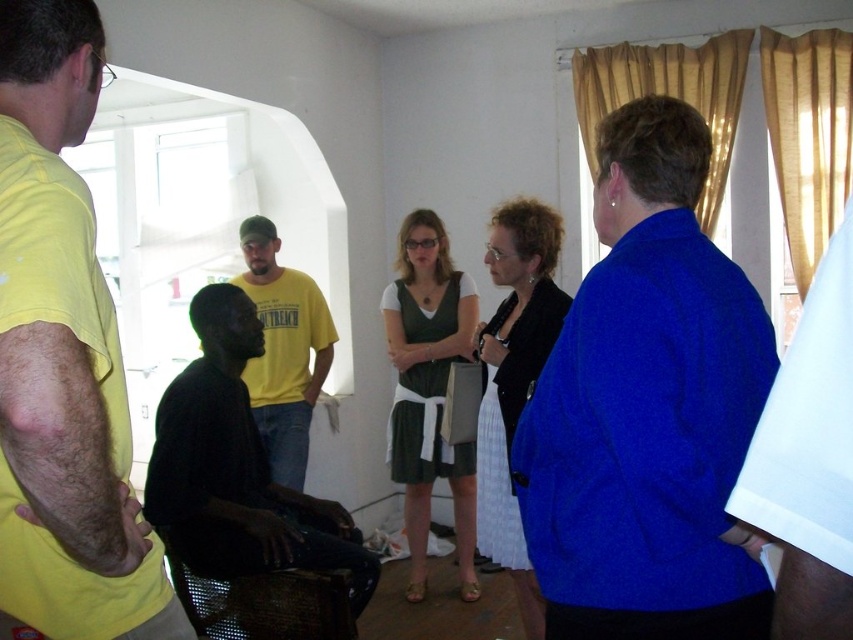
Question: Does yellow matte shirt at left have a greater width compared to yellow cotton t-shirt at center?

Choices:
 (A) no
 (B) yes

Answer: (A)

Question: Is black satin blouse at center above yellow cotton t-shirt at center?

Choices:
 (A) yes
 (B) no

Answer: (B)

Question: Estimate the real-world distances between objects in this image. Which object is farther from the matte green dress at center?

Choices:
 (A) black matte shirt at lower left
 (B) black satin blouse at center
 (C) yellow matte shirt at left
 (D) yellow cotton t-shirt at center

Answer: (C)

Question: Can you confirm if yellow matte shirt at left is positioned to the right of black satin blouse at center?

Choices:
 (A) yes
 (B) no

Answer: (B)

Question: Which of these objects is positioned farthest from the yellow cotton t-shirt at center?

Choices:
 (A) yellow matte shirt at left
 (B) black matte shirt at lower left
 (C) black satin blouse at center

Answer: (A)

Question: Among these points, which one is nearest to the camera?

Choices:
 (A) (103, 541)
 (B) (300, 516)
 (C) (422, 369)
 (D) (601, 502)

Answer: (A)